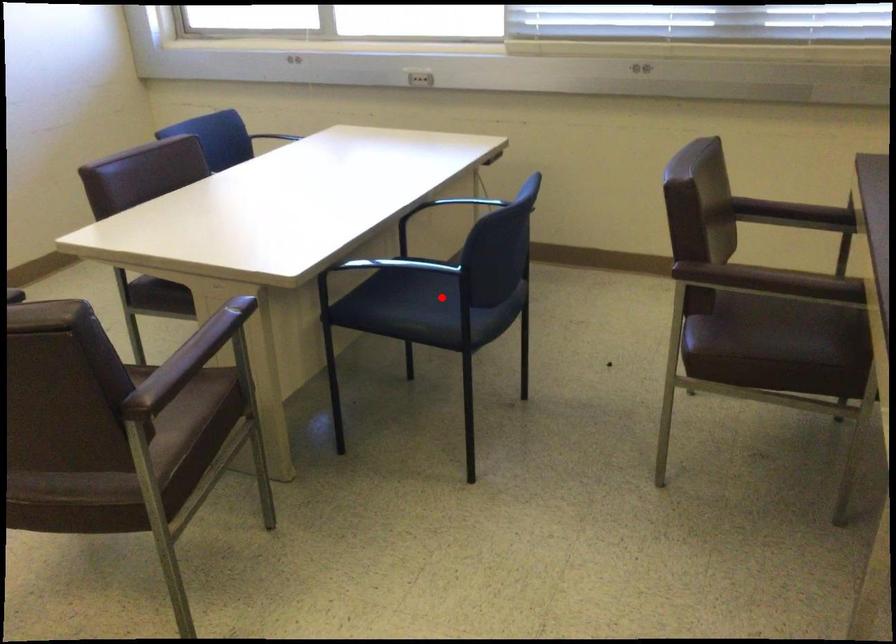
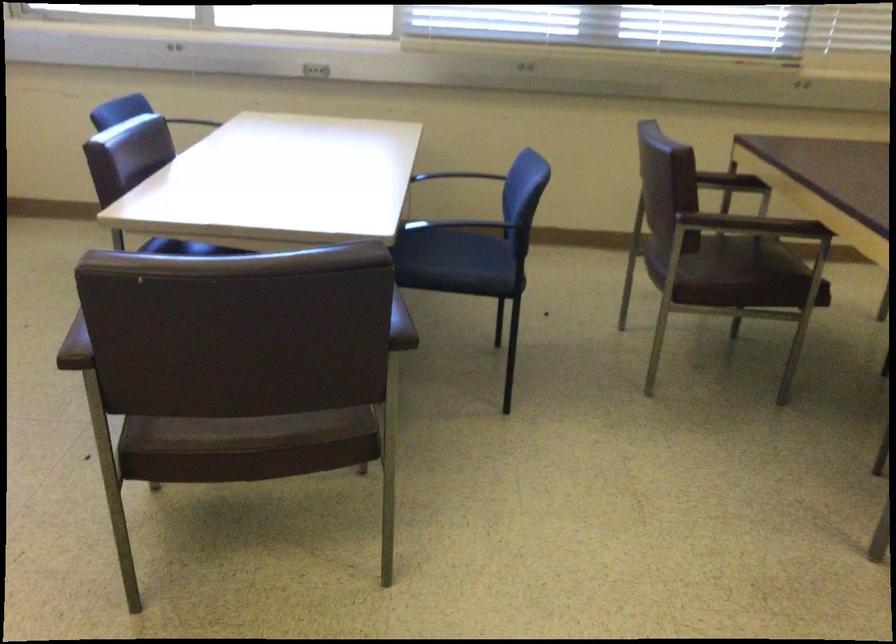
The point at the highlighted location is marked in the first image. Where is the corresponding point in the second image?

(458, 261)